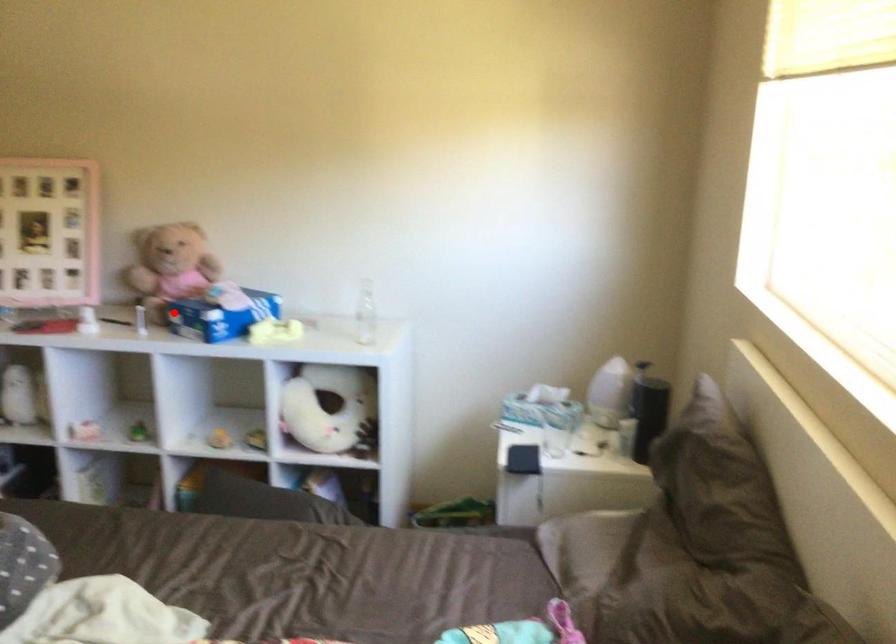
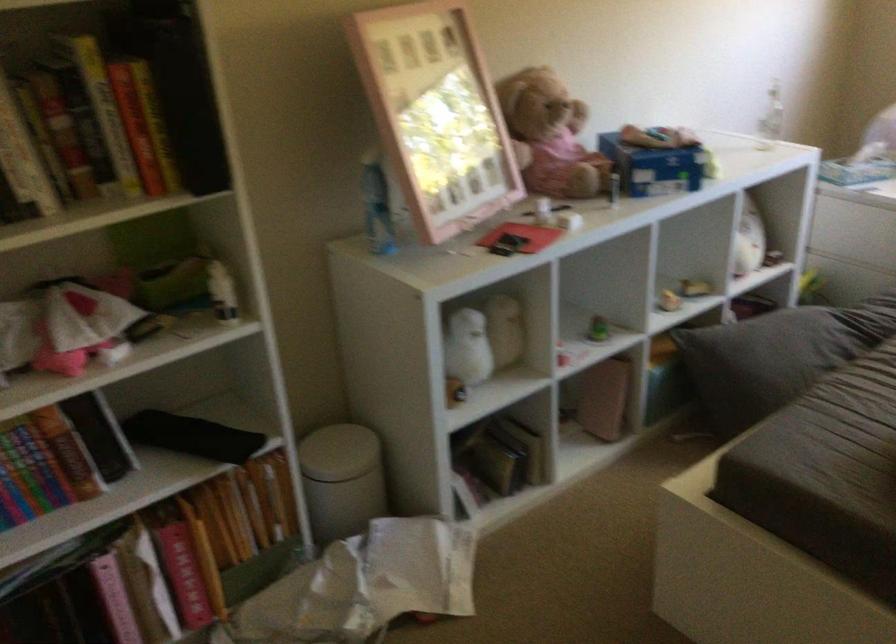
The point at the highlighted location is marked in the first image. Where is the corresponding point in the second image?

(655, 166)